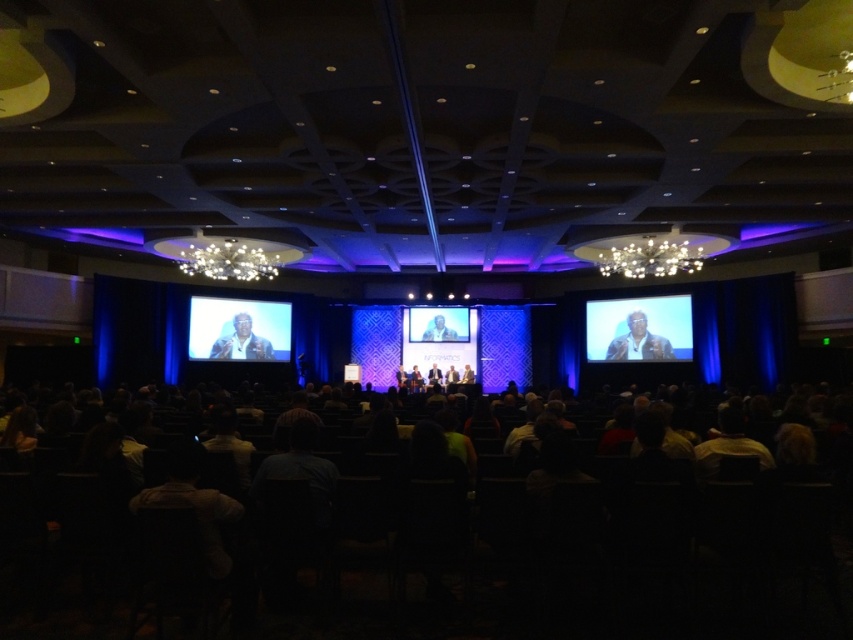
Question: Is dark fabric chairs at lower center bigger than light brown leather jacket at center?

Choices:
 (A) yes
 (B) no

Answer: (A)

Question: Can you confirm if matte black screen at right is thinner than light brown leather jacket at center?

Choices:
 (A) yes
 (B) no

Answer: (B)

Question: Which object appears farthest from the camera in this image?

Choices:
 (A) matte black screen at center
 (B) leather jacket at right
 (C) light brown leather jacket at center
 (D) dark fabric chairs at lower center

Answer: (C)

Question: Is dark fabric chairs at lower center bigger than smooth skin at center?

Choices:
 (A) no
 (B) yes

Answer: (B)

Question: Among these objects, which one is farthest from the camera?

Choices:
 (A) dark fabric chairs at lower center
 (B) leather jacket at right
 (C) light brown leather jacket at center

Answer: (C)

Question: Among these points, which one is nearest to the camera?

Choices:
 (A) (231, 324)
 (B) (653, 301)
 (C) (642, 356)
 (D) (436, 380)

Answer: (B)